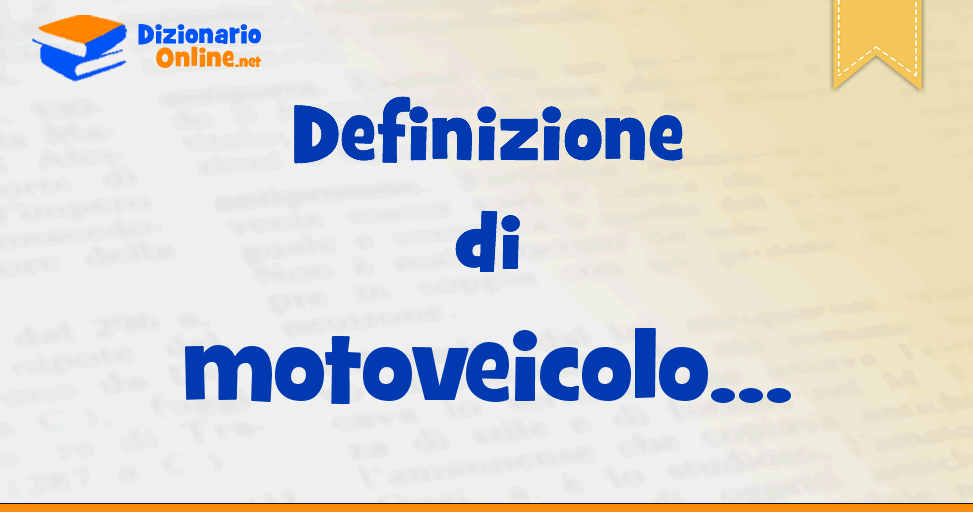
Identify the location of blue book. (75, 71).